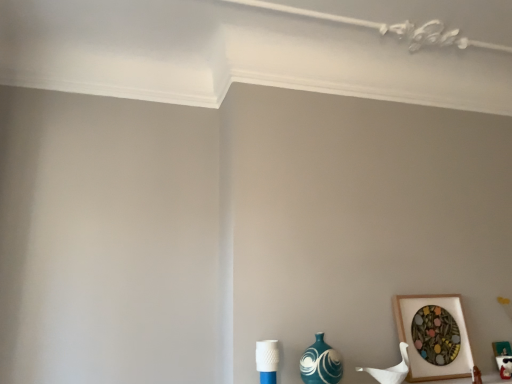
Question: Is the depth of teal glossy vase at lower right greater than that of wooden picture frame at lower right?

Choices:
 (A) no
 (B) yes

Answer: (A)

Question: Is teal glossy vase at lower right wider than wooden picture frame at lower right?

Choices:
 (A) no
 (B) yes

Answer: (B)

Question: Is wooden picture frame at lower right at the back of teal glossy vase at lower right?

Choices:
 (A) yes
 (B) no

Answer: (B)

Question: From the image's perspective, would you say teal glossy vase at lower right is shown under wooden picture frame at lower right?

Choices:
 (A) yes
 (B) no

Answer: (A)

Question: From a real-world perspective, does teal glossy vase at lower right stand above wooden picture frame at lower right?

Choices:
 (A) yes
 (B) no

Answer: (B)

Question: Does teal glossy vase at lower right have a greater height compared to wooden picture frame at lower right?

Choices:
 (A) no
 (B) yes

Answer: (A)

Question: Can we say wooden picture frame at lower right lies outside teal glossy vase at lower right?

Choices:
 (A) no
 (B) yes

Answer: (B)

Question: Considering the relative sizes of wooden picture frame at lower right and teal glossy vase at lower right in the image provided, is wooden picture frame at lower right smaller than teal glossy vase at lower right?

Choices:
 (A) yes
 (B) no

Answer: (B)

Question: From the image's perspective, does wooden picture frame at lower right appear lower than teal glossy vase at lower right?

Choices:
 (A) no
 (B) yes

Answer: (A)

Question: Is wooden picture frame at lower right in contact with teal glossy vase at lower right?

Choices:
 (A) no
 (B) yes

Answer: (A)

Question: Considering the relative sizes of wooden picture frame at lower right and teal glossy vase at lower right in the image provided, is wooden picture frame at lower right taller than teal glossy vase at lower right?

Choices:
 (A) no
 (B) yes

Answer: (B)

Question: Is wooden picture frame at lower right further to camera compared to teal glossy vase at lower right?

Choices:
 (A) no
 (B) yes

Answer: (B)

Question: From a real-world perspective, is teal glossy vase at lower right positioned above or below wooden picture frame at lower right?

Choices:
 (A) above
 (B) below

Answer: (B)